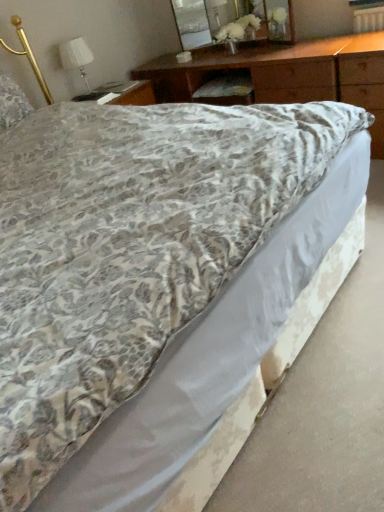
What is the approximate width of white fabric lampshade at upper left?

The width of white fabric lampshade at upper left is 8.25 inches.

At what (x,y) coordinates should I click in order to perform the action: click on clear glass mirror at upper center. Please return your answer as a coordinate pair (x, y). Image resolution: width=384 pixels, height=512 pixels. Looking at the image, I should click on (232, 20).

From the picture: In order to face fluffy white pillow at upper left, should I rotate leftwards or rightwards?

You should rotate left by 24.351 degrees.

Find the location of `white fabric lampshade at upper left`. white fabric lampshade at upper left is located at coordinates (76, 58).

Which is behind, point (78, 57) or point (206, 40)?

The point (206, 40) is behind.

Between white fabric lampshade at upper left and clear glass mirror at upper center, which one is positioned behind?

white fabric lampshade at upper left is behind.

Is white fabric lampshade at upper left shorter than clear glass mirror at upper center?

Indeed, white fabric lampshade at upper left has a lesser height compared to clear glass mirror at upper center.

Find the location of `table lamp on the left side of wooden at upper center`. table lamp on the left side of wooden at upper center is located at coordinates (76, 58).

From a real-world perspective, is wooden at upper center below white fabric lampshade at upper left?

Yes, from a real-world perspective, wooden at upper center is below white fabric lampshade at upper left.

Considering the sizes of objects wooden at upper center and white fabric lampshade at upper left in the image provided, who is shorter, wooden at upper center or white fabric lampshade at upper left?

With less height is white fabric lampshade at upper left.

Can you confirm if wooden at upper center is smaller than white fabric lampshade at upper left?

No.

Is clear glass mirror at upper center in front of white fabric lampshade at upper left?

Yes, clear glass mirror at upper center is in front of white fabric lampshade at upper left.

Is white fabric lampshade at upper left at the back of clear glass mirror at upper center?

clear glass mirror at upper center does not have its back to white fabric lampshade at upper left.

Between clear glass mirror at upper center and white fabric lampshade at upper left, which one appears on the left side from the viewer's perspective?

white fabric lampshade at upper left.

The width and height of the screenshot is (384, 512). I want to click on mirror below the white fabric lampshade at upper left (from a real-world perspective), so click(232, 20).

Can you see white fabric lampshade at upper left touching fluffy white pillow at upper left?

white fabric lampshade at upper left and fluffy white pillow at upper left are clearly separated.

Is white fabric lampshade at upper left outside of fluffy white pillow at upper left?

Yes, white fabric lampshade at upper left is outside of fluffy white pillow at upper left.

From a real-world perspective, relative to fluffy white pillow at upper left, is white fabric lampshade at upper left vertically above or below?

In terms of real-world spatial position, white fabric lampshade at upper left is below fluffy white pillow at upper left.

Considering the positions of objects white fabric lampshade at upper left and fluffy white pillow at upper left in the image provided, who is more to the right, white fabric lampshade at upper left or fluffy white pillow at upper left?

From the viewer's perspective, white fabric lampshade at upper left appears more on the right side.

Looking at their sizes, would you say fluffy white pillow at upper left is wider or thinner than wooden at upper center?

In the image, fluffy white pillow at upper left appears to be more narrow than wooden at upper center.

From their relative heights in the image, would you say fluffy white pillow at upper left is taller or shorter than wooden at upper center?

Considering their sizes, fluffy white pillow at upper left has less height than wooden at upper center.

Locate an element on the screen. Image resolution: width=384 pixels, height=512 pixels. pillow that is above the wooden at upper center (from a real-world perspective) is located at coordinates (12, 103).

Considering the relative positions of clear glass mirror at upper center and fluffy white pillow at upper left in the image provided, is clear glass mirror at upper center to the left or to the right of fluffy white pillow at upper left?

Based on their positions, clear glass mirror at upper center is located to the right of fluffy white pillow at upper left.

What are the coordinates of `pillow below the clear glass mirror at upper center (from the image's perspective)` in the screenshot? It's located at (12, 103).

You are a GUI agent. You are given a task and a screenshot of the screen. Output one action in this format:
    pyautogui.click(x=<x>, y=<y>)
    Task: Click on the pillow in front of the clear glass mirror at upper center
    
    Given the screenshot: What is the action you would take?
    pyautogui.click(x=12, y=103)

Is fluffy white pillow at upper left positioned far away from clear glass mirror at upper center?

fluffy white pillow at upper left is positioned a significant distance from clear glass mirror at upper center.

Considering the positions of point (14, 117) and point (192, 39), is point (14, 117) closer or farther from the camera than point (192, 39)?

Point (14, 117) appears to be closer to the viewer than point (192, 39).

The image size is (384, 512). Identify the location of mirror in front of the white fabric lampshade at upper left. (232, 20).

The height and width of the screenshot is (512, 384). I want to click on table lamp located above the wooden at upper center (from a real-world perspective), so click(x=76, y=58).

Based on their spatial positions, is fluffy white pillow at upper left or wooden at upper center closer to white fabric lampshade at upper left?

Among the two, fluffy white pillow at upper left is located nearer to white fabric lampshade at upper left.

Estimate the real-world distances between objects in this image. Which object is closer to white fabric lampshade at upper left, clear glass mirror at upper center or fluffy white pillow at upper left?

Among the two, fluffy white pillow at upper left is located nearer to white fabric lampshade at upper left.

Based on their spatial positions, is clear glass mirror at upper center or white fabric lampshade at upper left further from fluffy white pillow at upper left?

clear glass mirror at upper center is positioned further to the anchor fluffy white pillow at upper left.

Which object lies further to the anchor point clear glass mirror at upper center, white fabric lampshade at upper left or fluffy white pillow at upper left?

fluffy white pillow at upper left is further to clear glass mirror at upper center.

When comparing their distances from white fabric lampshade at upper left, does fluffy white pillow at upper left or clear glass mirror at upper center seem further?

The object further to white fabric lampshade at upper left is clear glass mirror at upper center.

Looking at the image, which one is located closer to clear glass mirror at upper center, wooden at upper center or white fabric lampshade at upper left?

Based on the image, wooden at upper center appears to be nearer to clear glass mirror at upper center.

From the image, which object appears to be nearer to fluffy white pillow at upper left, wooden at upper center or clear glass mirror at upper center?

wooden at upper center lies closer to fluffy white pillow at upper left than the other object.

Estimate the real-world distances between objects in this image. Which object is closer to white fabric lampshade at upper left, wooden at upper center or clear glass mirror at upper center?

wooden at upper center is closer to white fabric lampshade at upper left.

Locate an element on the screen. The width and height of the screenshot is (384, 512). table lamp between fluffy white pillow at upper left and clear glass mirror at upper center from left to right is located at coordinates (76, 58).

The width and height of the screenshot is (384, 512). What are the coordinates of `table lamp between fluffy white pillow at upper left and wooden at upper center in the horizontal direction` in the screenshot? It's located at (76, 58).

Identify the location of mirror located between white fabric lampshade at upper left and wooden at upper center in the left-right direction. This screenshot has width=384, height=512. (232, 20).

At what (x,y) coordinates should I click in order to perform the action: click on mirror located between fluffy white pillow at upper left and wooden at upper center in the left-right direction. Please return your answer as a coordinate pair (x, y). The image size is (384, 512). Looking at the image, I should click on (232, 20).